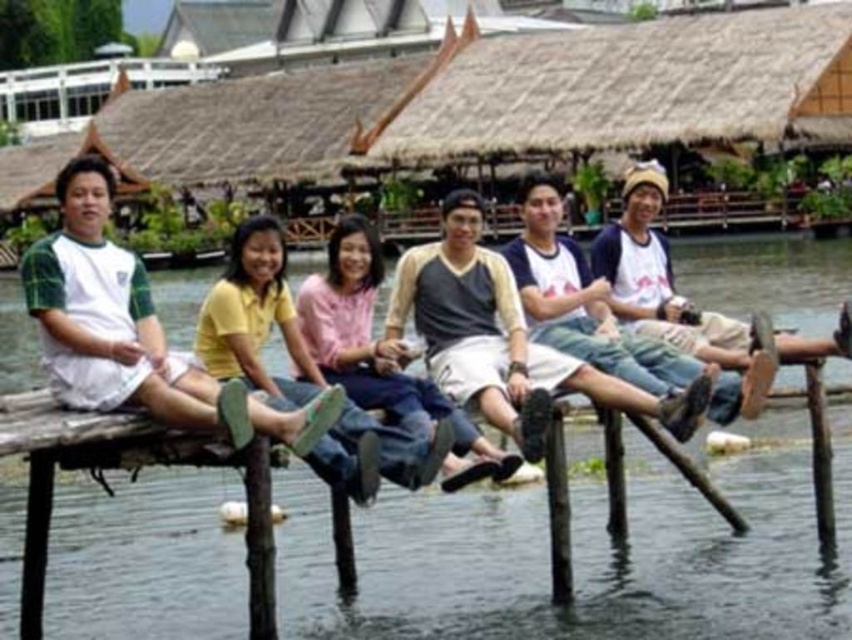
Does yellow matte shirt at center appear under pink fabric shirt at center?

No, yellow matte shirt at center is not below pink fabric shirt at center.

Between point (260, 276) and point (390, 353), which one is positioned in front?

Positioned in front is point (260, 276).

What are the coordinates of `yellow matte shirt at center` in the screenshot? It's located at (255, 317).

Is point (462, 541) less distant than point (327, 326)?

That is False.

Which is above, clear blue water at center or pink fabric shirt at center?

Positioned higher is clear blue water at center.

Identify the location of clear blue water at center. This screenshot has height=640, width=852. (583, 548).

Where is `clear blue water at center`? Image resolution: width=852 pixels, height=640 pixels. clear blue water at center is located at coordinates (583, 548).

Can you confirm if clear blue water at center is shorter than white-green striped shirt at left?

Indeed, clear blue water at center has a lesser height compared to white-green striped shirt at left.

Is clear blue water at center thinner than white-green striped shirt at left?

No, clear blue water at center is not thinner than white-green striped shirt at left.

Locate an element on the screen. This screenshot has height=640, width=852. clear blue water at center is located at coordinates (583, 548).

Image resolution: width=852 pixels, height=640 pixels. Find the location of `clear blue water at center`. clear blue water at center is located at coordinates (583, 548).